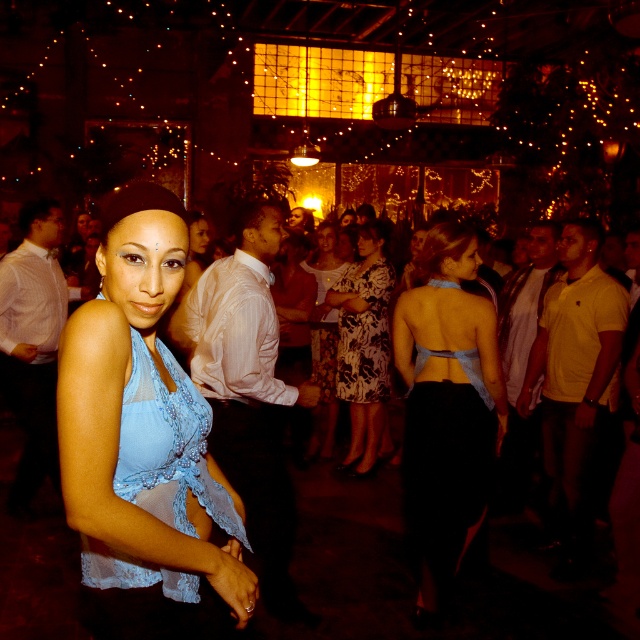
Question: Which of the following is the farthest from the observer?

Choices:
 (A) floral dress at center
 (B) light blue satin dress at center

Answer: (A)

Question: Estimate the real-world distances between objects in this image. Which object is closer to the white sheer shirt at center?

Choices:
 (A) white satin shirt at left
 (B) yellow cotton shirt at right
 (C) yellow cotton polo shirt at right

Answer: (A)

Question: Which of the following is the closest to the observer?

Choices:
 (A) (186, 333)
 (B) (502, 476)

Answer: (A)

Question: Does yellow cotton polo shirt at right lie in front of matte white blouse at center?

Choices:
 (A) no
 (B) yes

Answer: (A)

Question: Is light blue lace top at center to the left of white sheer shirt at center from the viewer's perspective?

Choices:
 (A) yes
 (B) no

Answer: (B)

Question: Is light blue lace top at center closer to the viewer compared to floral print fabric dress at center?

Choices:
 (A) no
 (B) yes

Answer: (B)